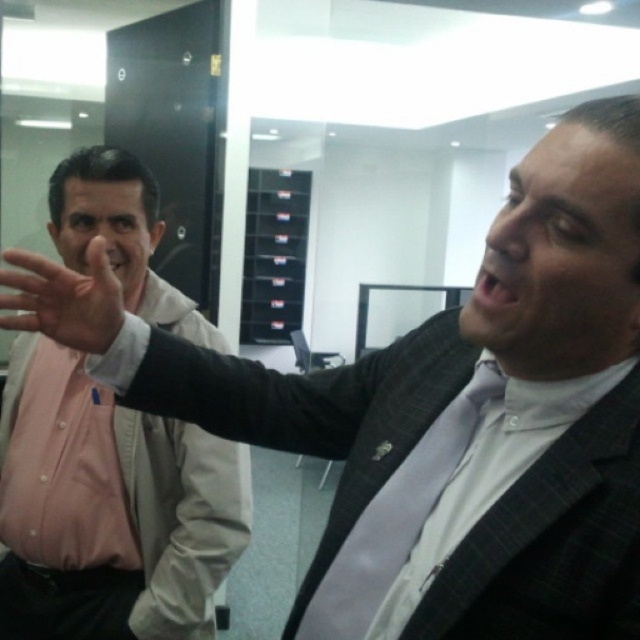
Who is more distant from viewer, (236,449) or (90,349)?

The point (236,449) is more distant.

The image size is (640, 640). Describe the element at coordinates (108, 509) in the screenshot. I see `pink shirt at left` at that location.

Does point (209, 596) come behind point (120, 321)?

That is True.

The width and height of the screenshot is (640, 640). I want to click on pink shirt at left, so click(108, 509).